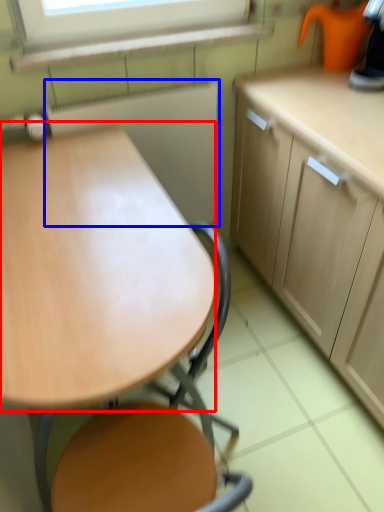
Question: Which object is further to the camera taking this photo, round table (highlighted by a red box) or appliance (highlighted by a blue box)?

Choices:
 (A) round table
 (B) appliance

Answer: (B)